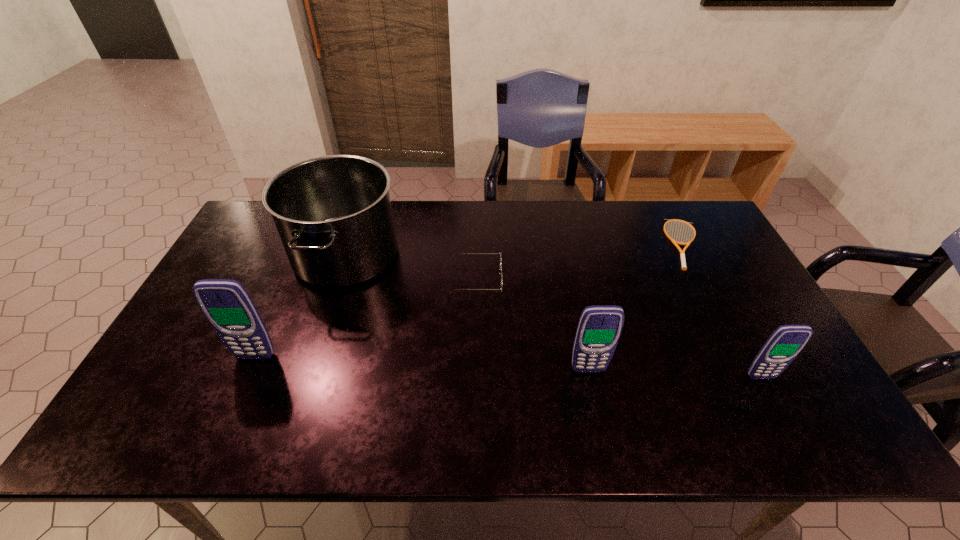
Identify the location of vacant space located 0.100m on the right of the saucepan. (432, 254).

Where is `vacant region located 0.400m on the front of the shortest object`? The image size is (960, 540). vacant region located 0.400m on the front of the shortest object is located at coordinates (759, 384).

This screenshot has height=540, width=960. In order to click on vacant point located 0.310m on the front-facing side of the third object from left to right in this screenshot , I will do `click(604, 279)`.

Locate an element on the screen. saucepan that is at the far edge is located at coordinates (333, 213).

You are a GUI agent. You are given a task and a screenshot of the screen. Output one action in this format:
    pyautogui.click(x=<x>, y=<y>)
    Task: Click on the tennis racket at the far edge
    
    Given the screenshot: What is the action you would take?
    pyautogui.click(x=682, y=253)

Locate an element on the screen. Image resolution: width=960 pixels, height=540 pixels. cellular telephone located in the right edge section of the desktop is located at coordinates pos(785,343).

The width and height of the screenshot is (960, 540). Find the location of `tennis racket that is at the right edge`. tennis racket that is at the right edge is located at coordinates (682, 253).

Locate an element on the screen. Image resolution: width=960 pixels, height=540 pixels. object located in the far right corner section of the desktop is located at coordinates (682, 253).

Find the location of `object that is positioned at the near right corner`. object that is positioned at the near right corner is located at coordinates (785, 343).

Where is `blank space at the far edge of the desktop`? This screenshot has width=960, height=540. blank space at the far edge of the desktop is located at coordinates (635, 239).